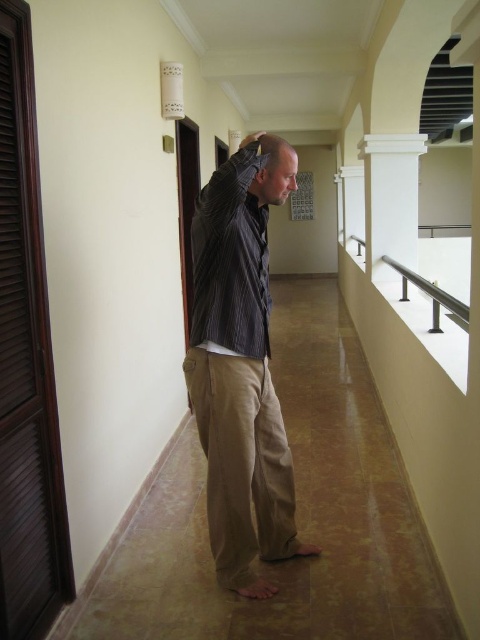
Does striped fabric shirt at center come in front of satin silver railing at right?

Yes, it is in front of satin silver railing at right.

Is striped fabric shirt at center below satin silver railing at right?

Correct, striped fabric shirt at center is located below satin silver railing at right.

Who is more distant from viewer, (252, 433) or (408, 269)?

The point (408, 269) is behind.

Find the location of a particular element. Image resolution: width=480 pixels, height=640 pixels. striped fabric shirt at center is located at coordinates (240, 365).

Is striped fabric shirt at center below white smooth column at upper right?

Indeed, striped fabric shirt at center is positioned under white smooth column at upper right.

Who is positioned more to the right, striped fabric shirt at center or white smooth column at upper right?

Positioned to the right is white smooth column at upper right.

I want to click on striped fabric shirt at center, so click(240, 365).

Between light brown hair at center and satin silver railing at right, which one has less height?

light brown hair at center is shorter.

Who is higher up, light brown hair at center or satin silver railing at right?

Positioned higher is light brown hair at center.

Between point (291, 148) and point (357, 237), which one is positioned in front?

Point (291, 148) is in front.

Locate an element on the screen. The height and width of the screenshot is (640, 480). light brown hair at center is located at coordinates (273, 170).